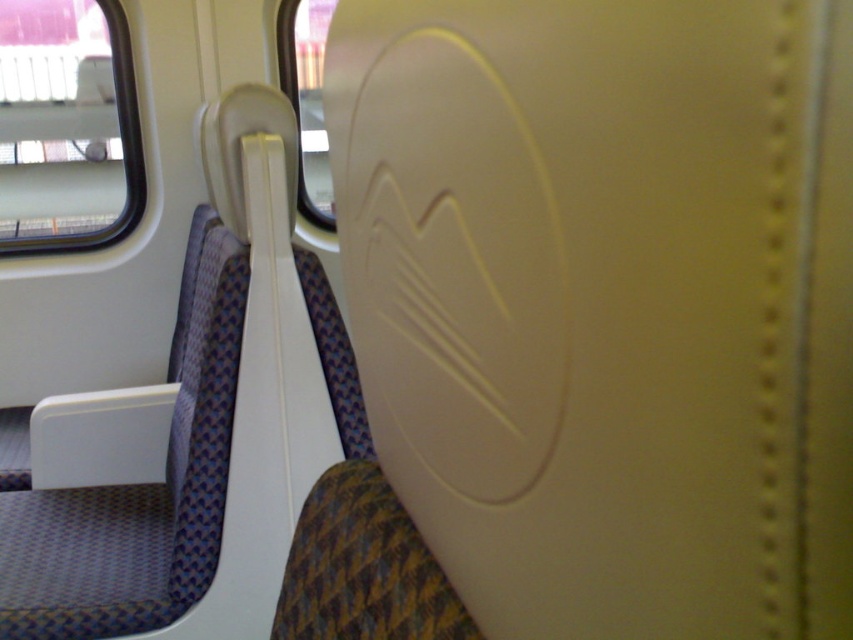
Which is in front, point (70, 72) or point (292, 72)?

Positioned in front is point (292, 72).

Does transparent glass window at upper left have a lesser height compared to transparent glass window at upper center?

No.

Between point (28, 28) and point (282, 26), which one is positioned in front?

Point (282, 26) is more forward.

The width and height of the screenshot is (853, 640). What are the coordinates of `transparent glass window at upper left` in the screenshot? It's located at tap(67, 128).